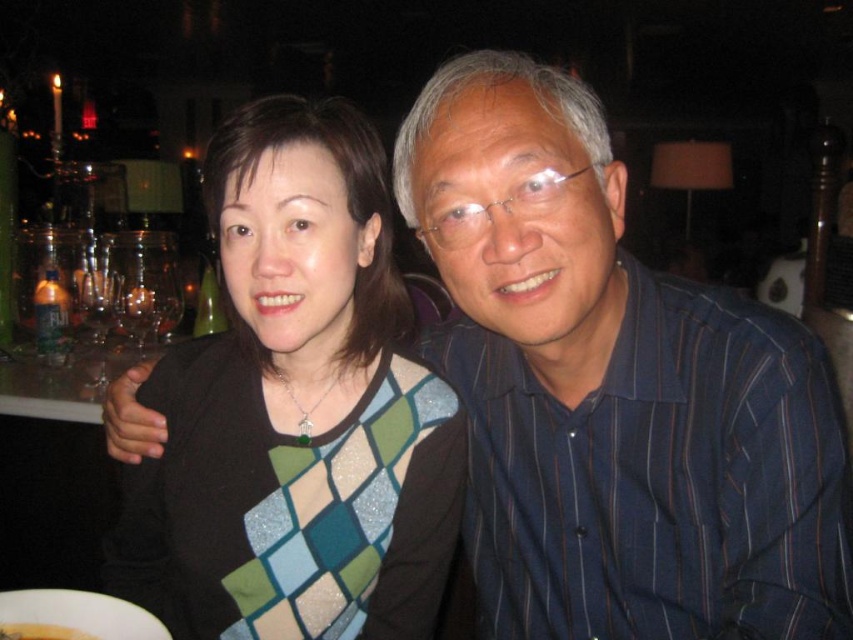
Is white glossy plate at lower left to the right of yellow smooth banana at lower left from the viewer's perspective?

No, white glossy plate at lower left is not to the right of yellow smooth banana at lower left.

Does point (3, 632) come in front of point (33, 628)?

Yes, it is in front of point (33, 628).

Locate an element on the screen. Image resolution: width=853 pixels, height=640 pixels. white glossy plate at lower left is located at coordinates (74, 616).

Is matte black sweater at center to the right of yellow smooth banana at lower left from the viewer's perspective?

Yes, matte black sweater at center is to the right of yellow smooth banana at lower left.

Is matte black sweater at center closer to the viewer compared to yellow smooth banana at lower left?

No, it is behind yellow smooth banana at lower left.

I want to click on matte black sweater at center, so click(300, 404).

Is matte glass table at lower left closer to camera compared to white glossy plate at lower left?

That is False.

Who is higher up, matte glass table at lower left or white glossy plate at lower left?

matte glass table at lower left

Between point (91, 384) and point (16, 634), which one is positioned behind?

Positioned behind is point (91, 384).

This screenshot has height=640, width=853. I want to click on matte glass table at lower left, so click(x=64, y=384).